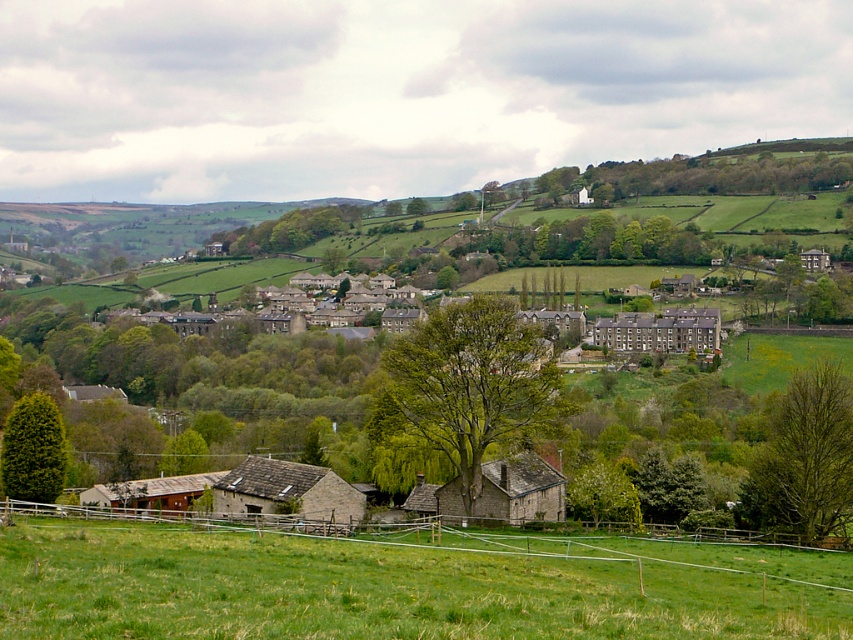
Question: Does green leafy tree at center-right lie in front of green leafy tree at lower left?

Choices:
 (A) yes
 (B) no

Answer: (B)

Question: Which point is farther from the camera taking this photo?

Choices:
 (A) (444, 392)
 (B) (38, 406)

Answer: (B)

Question: Is green leafy tree at center to the right of green leafy tree at lower left from the viewer's perspective?

Choices:
 (A) no
 (B) yes

Answer: (B)

Question: Does green grassy field at lower center appear under green leafy tree at lower left?

Choices:
 (A) no
 (B) yes

Answer: (B)

Question: Which object is the farthest from the green leafy tree at lower left?

Choices:
 (A) green leafy tree at center-right
 (B) green leafy tree at center
 (C) green grassy field at lower center

Answer: (A)

Question: Which object is the closest to the green leafy tree at center-right?

Choices:
 (A) green leafy tree at center
 (B) green leafy tree at lower left
 (C) green grassy field at lower center

Answer: (A)